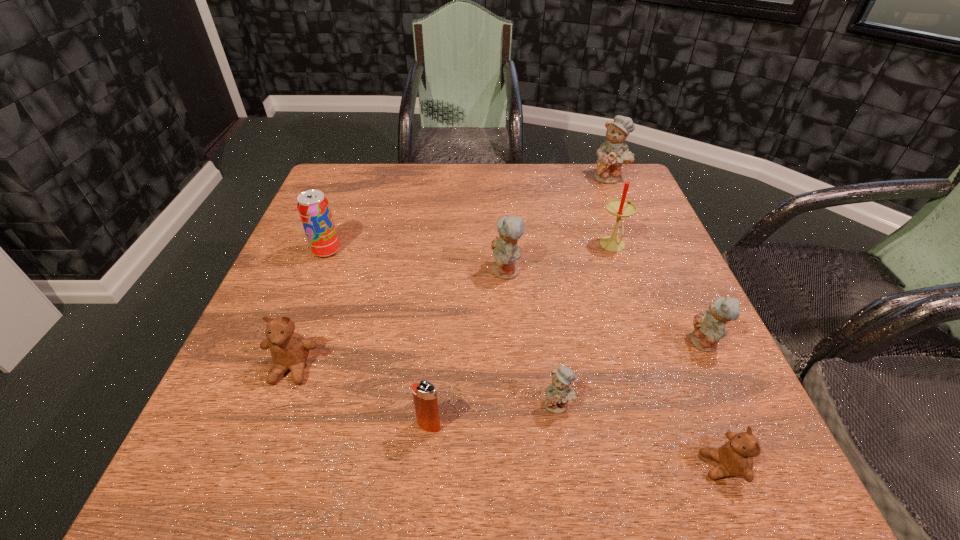
Locate an element on the screen. The height and width of the screenshot is (540, 960). unoccupied area between the soda can and the fourth object from left to right is located at coordinates (417, 261).

Locate an element on the screen. The image size is (960, 540). blank region between the soda can and the nearest teddy bear is located at coordinates (524, 358).

Identify which object is the sixth closest to the third nearest blue teddy bear. Please provide its 2D coordinates. Your answer should be formatted as a tuple, i.e. [(x, y)], where the tuple contains the x and y coordinates of a point satisfying the conditions above.

[(289, 350)]

At what (x,y) coordinates should I click in order to perform the action: click on object that is the fifth closest to the second smallest blue teddy bear. Please return your answer as a coordinate pair (x, y). Image resolution: width=960 pixels, height=540 pixels. Looking at the image, I should click on (424, 393).

Locate which teddy bear ranks in proximity to the right brown teddy bear. Please provide its 2D coordinates. Your answer should be formatted as a tuple, i.e. [(x, y)], where the tuple contains the x and y coordinates of a point satisfying the conditions above.

[(709, 326)]

Locate which teddy bear is the second closest to the candle. Please provide its 2D coordinates. Your answer should be formatted as a tuple, i.e. [(x, y)], where the tuple contains the x and y coordinates of a point satisfying the conditions above.

[(709, 326)]

You are a GUI agent. You are given a task and a screenshot of the screen. Output one action in this format:
    pyautogui.click(x=<x>, y=<y>)
    Task: Click on the blue teddy bear object that ranks as the closest to the second smallest blue teddy bear
    The width and height of the screenshot is (960, 540).
    Given the screenshot: What is the action you would take?
    pyautogui.click(x=558, y=393)

Select which blue teddy bear appears as the fourth closest to the nearest object. Please provide its 2D coordinates. Your answer should be formatted as a tuple, i.e. [(x, y)], where the tuple contains the x and y coordinates of a point satisfying the conditions above.

[(611, 155)]

I want to click on free location that satisfies the following two spatial constraints: 1. on the front-facing side of the second nearest blue teddy bear; 2. on the front side of the eighth farthest object, so click(743, 425).

The height and width of the screenshot is (540, 960). I want to click on vacant region that satisfies the following two spatial constraints: 1. on the front-facing side of the farthest blue teddy bear; 2. on the face of the right brown teddy bear, so click(x=729, y=466).